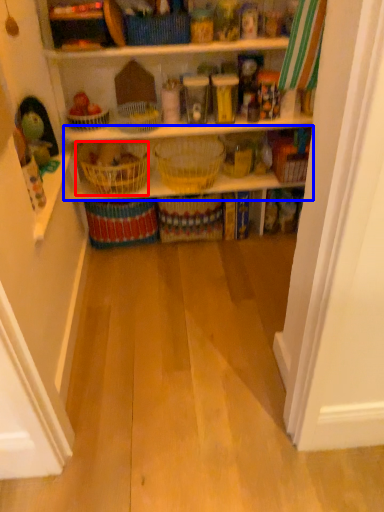
Question: Among these objects, which one is nearest to the camera, basket (highlighted by a red box) or shelf (highlighted by a blue box)?

Choices:
 (A) basket
 (B) shelf

Answer: (A)